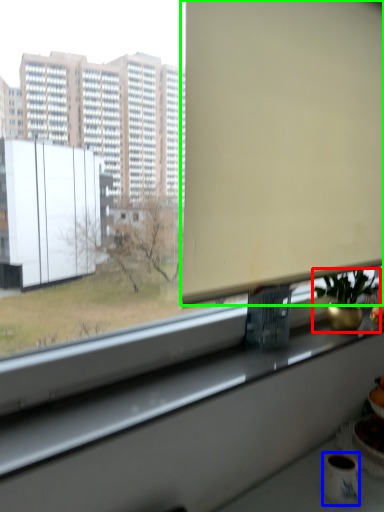
Question: Estimate the real-world distances between objects in this image. Which object is farther from houseplant (highlighted by a red box), mug (highlighted by a blue box) or window screen (highlighted by a green box)?

Choices:
 (A) mug
 (B) window screen

Answer: (A)